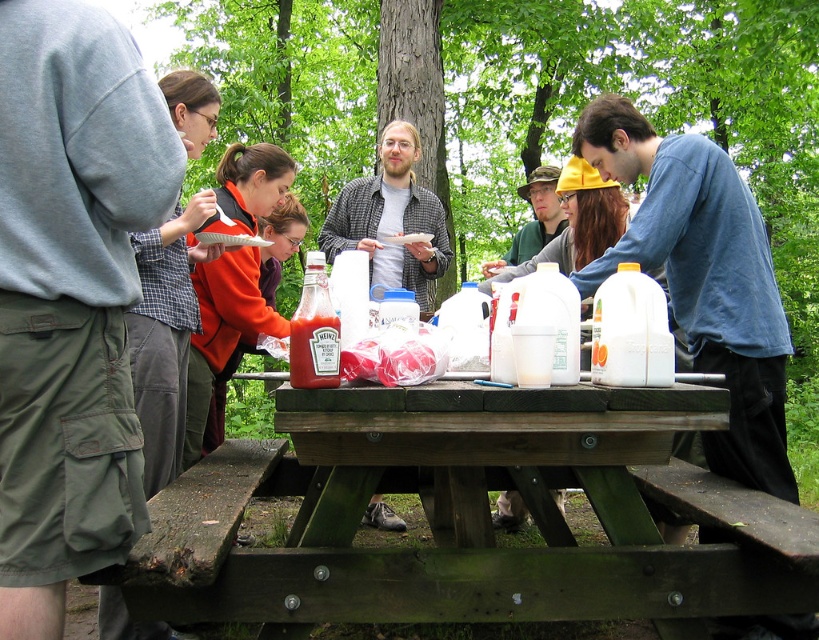
Question: Does gray cotton shirt at upper left have a smaller size compared to white plastic bag at center?

Choices:
 (A) no
 (B) yes

Answer: (A)

Question: Estimate the real-world distances between objects in this image. Which object is closer to the translucent plastic ketchup bottle at center?

Choices:
 (A) orange fleece jacket at center
 (B) gray sweatshirt at left
 (C) plaid shirt at center

Answer: (B)

Question: Does gray cotton shirt at upper left appear on the right side of plaid shirt at center?

Choices:
 (A) no
 (B) yes

Answer: (A)

Question: Is orange fleece jacket at center behind plaid shirt at center?

Choices:
 (A) no
 (B) yes

Answer: (A)

Question: Which is farther from the translucent plastic ketchup bottle at center?

Choices:
 (A) gray sweatshirt at left
 (B) plaid shirt at center

Answer: (B)

Question: Which point is closer to the camera?

Choices:
 (A) plaid shirt at center
 (B) white plastic bag at center
 (C) orange fleece jacket at center
 (D) translucent plastic ketchup bottle at center

Answer: (D)